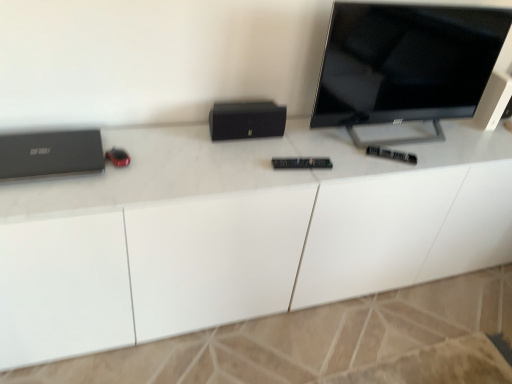
This screenshot has height=384, width=512. I want to click on empty space that is in between matte black laptop at left and black glossy tv at upper right, so click(204, 152).